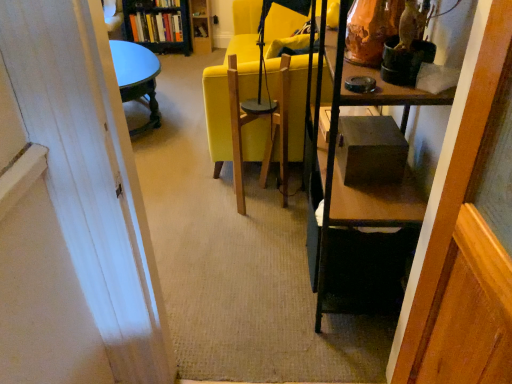
Find the location of a particular element. This screenshot has height=384, width=512. unoccupied area in front of wooden swivel chair at center is located at coordinates (265, 228).